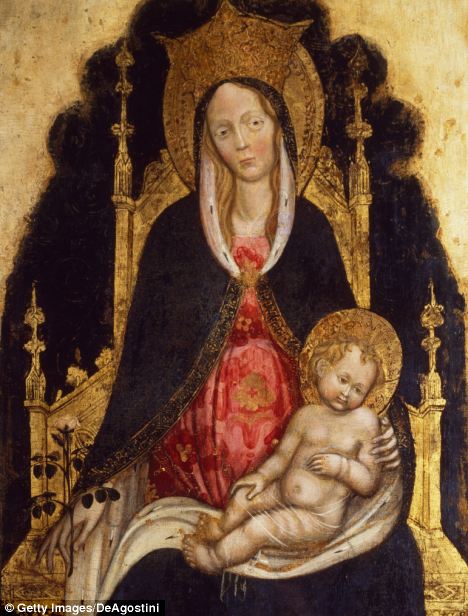
Find the location of a particular element. The width and height of the screenshot is (468, 616). golden chair is located at coordinates (151, 201).